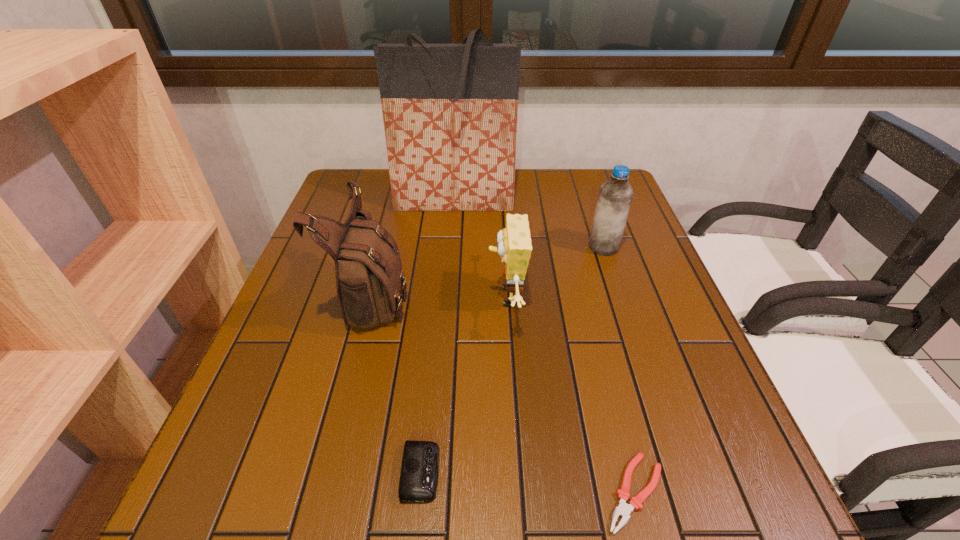
The height and width of the screenshot is (540, 960). In order to click on the tallest object in this screenshot , I will do `click(450, 111)`.

Where is `the farthest object`? The image size is (960, 540). the farthest object is located at coordinates [450, 111].

This screenshot has height=540, width=960. I want to click on the fifth shortest object, so click(x=369, y=278).

The height and width of the screenshot is (540, 960). I want to click on the second farthest object, so click(615, 196).

Find the location of `sponge`. sponge is located at coordinates (514, 246).

Locate an element on the screen. The width and height of the screenshot is (960, 540). the fifth tallest object is located at coordinates (418, 481).

Where is `pliers`? The image size is (960, 540). pliers is located at coordinates (623, 509).

Identify the location of free spot located on the front-facing side of the tallest object. The image size is (960, 540). (450, 247).

Locate an element on the screen. The image size is (960, 540). vacant space located on the front-facing side of the fifth shortest object is located at coordinates click(465, 295).

The width and height of the screenshot is (960, 540). Identify the location of free space located 0.180m on the back of the water bottle. (588, 202).